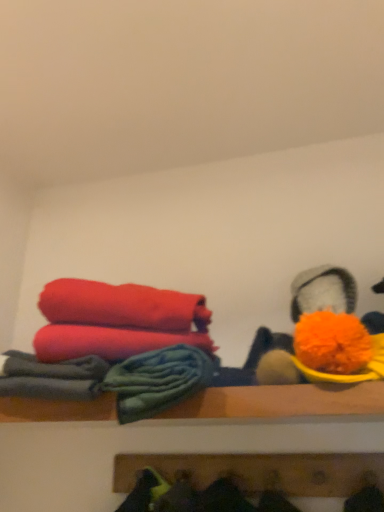
This screenshot has height=512, width=384. I want to click on free space above soft cotton towels at left (from a real-world perspective), so click(104, 344).